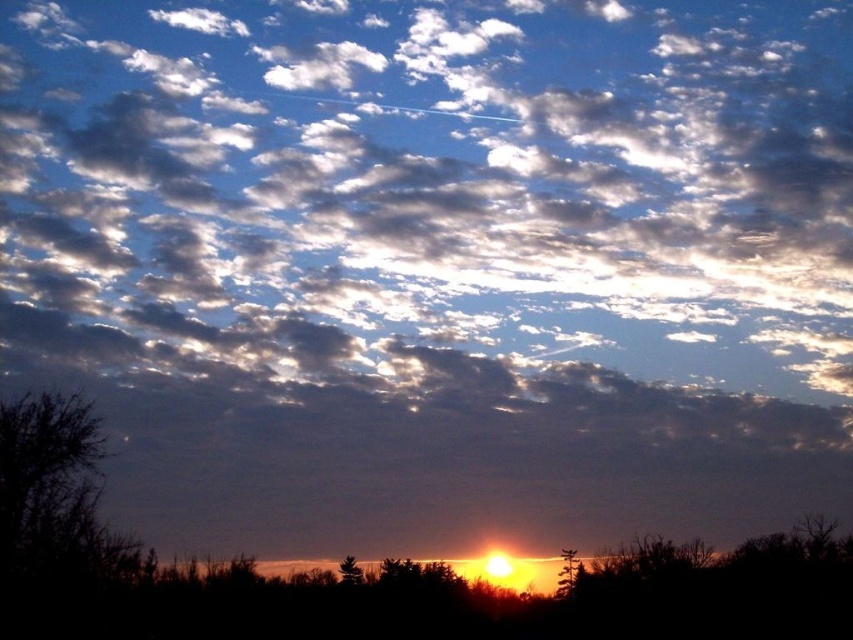
You are an artist trying to paint the sunset scene. You need to decide the order of painting the brown textured tree at lower center and the silvery textured pine tree at center based on their positions. Which tree should you paint first to ensure proper layering?

The silvery textured pine tree at center is behind the brown textured tree at lower center, so you should paint the brown textured tree at lower center first to ensure it appears in front.

You are standing in the sunset scene looking at the point marked at coordinates (567, 572). What object is located at that point?

The point at (567, 572) corresponds to the brown textured tree at lower center.